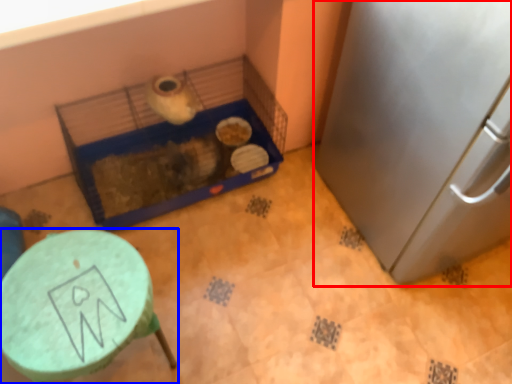
Question: Which of the following is the farthest to the observer, appliance (highlighted by a red box) or furniture (highlighted by a blue box)?

Choices:
 (A) appliance
 (B) furniture

Answer: (B)